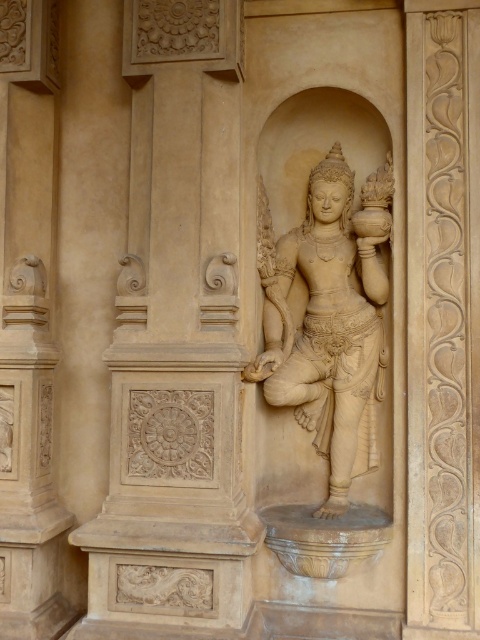
You are an architect analyzing the symmetry of the stone sculpture and its niche. The niche has a vertical column on the left side. Where is the corresponding column on the right side of the niche? Please provide the coordinates as a point in the format of point like point (176,340).

The point indicating the beige stone column at center is at point (176,340). Since the niche is symmetrical, the corresponding column on the right side would be mirrored across the central axis. However, the provided coordinates only specify the central column. Without additional information about the niche symmetry or right side elements, the exact coordinates cannot be determined.

You are an art conservator assessing the structural integrity of the beige stone column at center and the beige stone statue at center within the niche. Based on their positions, which object is more likely to be exposed to water damage from rain or moisture seeping from above?

The beige stone statue at center is more likely to be exposed to water damage from rain or moisture seeping from above because the beige stone column at center is located above it, potentially directing water downward.

You are an art conservator examining the beige stone column at center and the beige stone statue at center within the niche. Which object is positioned closer to the entrance of the niche?

The beige stone column at center is closer to the viewer than the beige stone statue at center, so the column is positioned closer to the entrance of the niche.